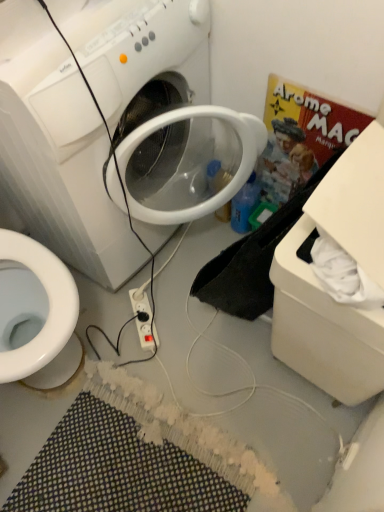
Question: From the image's perspective, relative to blue plastic bottle at center-right, is multicolored woven bath mat at lower center above or below?

Choices:
 (A) below
 (B) above

Answer: (A)

Question: Is multicolored woven bath mat at lower center spatially inside blue plastic bottle at center-right, or outside of it?

Choices:
 (A) outside
 (B) inside

Answer: (A)

Question: Estimate the real-world distances between objects in this image. Which object is closer to the white plastic box at lower right?

Choices:
 (A) white plastic washing machine at center
 (B) white plastic power outlet at center
 (C) blue plastic bottle at center-right
 (D) multicolored woven bath mat at lower center

Answer: (A)

Question: Estimate the real-world distances between objects in this image. Which object is closer to the white plastic power outlet at center?

Choices:
 (A) white plastic washing machine at center
 (B) white plastic box at lower right
 (C) blue plastic bottle at center-right
 (D) multicolored woven bath mat at lower center

Answer: (D)